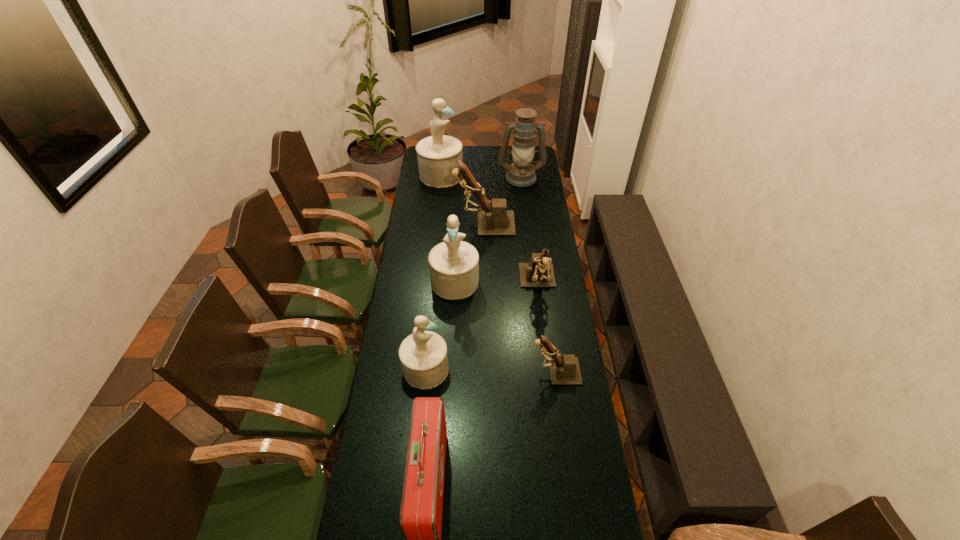
Find the location of a particular element. Image resolution: width=960 pixels, height=540 pixels. the biggest white figurine is located at coordinates (438, 155).

The height and width of the screenshot is (540, 960). I want to click on the farthest figurine, so click(438, 155).

The height and width of the screenshot is (540, 960). What are the coordinates of `oil lamp` in the screenshot? It's located at (521, 173).

Image resolution: width=960 pixels, height=540 pixels. In order to click on the second smallest white figurine in this screenshot , I will do `click(454, 264)`.

Identify the location of the biggest brown figurine. (495, 220).

Locate an element on the screen. The height and width of the screenshot is (540, 960). the sixth nearest object is located at coordinates (495, 220).

Where is `the nearest white figurine`? The image size is (960, 540). the nearest white figurine is located at coordinates (423, 354).

The width and height of the screenshot is (960, 540). I want to click on the second nearest brown figurine, so click(538, 273).

Image resolution: width=960 pixels, height=540 pixels. I want to click on the smallest brown figurine, so click(x=564, y=370).

This screenshot has height=540, width=960. Identify the location of the nearest brown figurine. (564, 370).